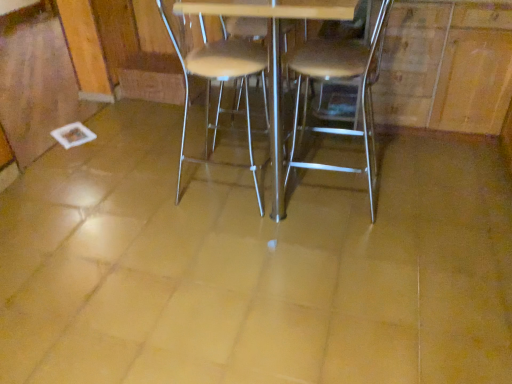
The height and width of the screenshot is (384, 512). Find the location of `free area in between metallic silver chair at center, the first chair positioned from the right, and metallic silver chair at center, arranged as the second chair when viewed from the right`. free area in between metallic silver chair at center, the first chair positioned from the right, and metallic silver chair at center, arranged as the second chair when viewed from the right is located at coordinates (294, 196).